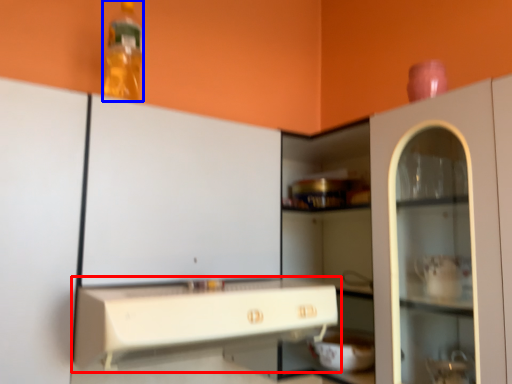
Question: Which object appears closest to the camera in this image, countertop (highlighted by a red box) or bottle (highlighted by a blue box)?

Choices:
 (A) countertop
 (B) bottle

Answer: (A)